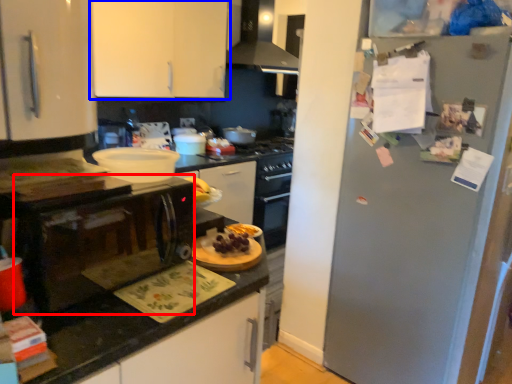
Question: Which point is closer to the camera, microwave (highlighted by a red box) or cabinetry (highlighted by a blue box)?

Choices:
 (A) microwave
 (B) cabinetry

Answer: (A)